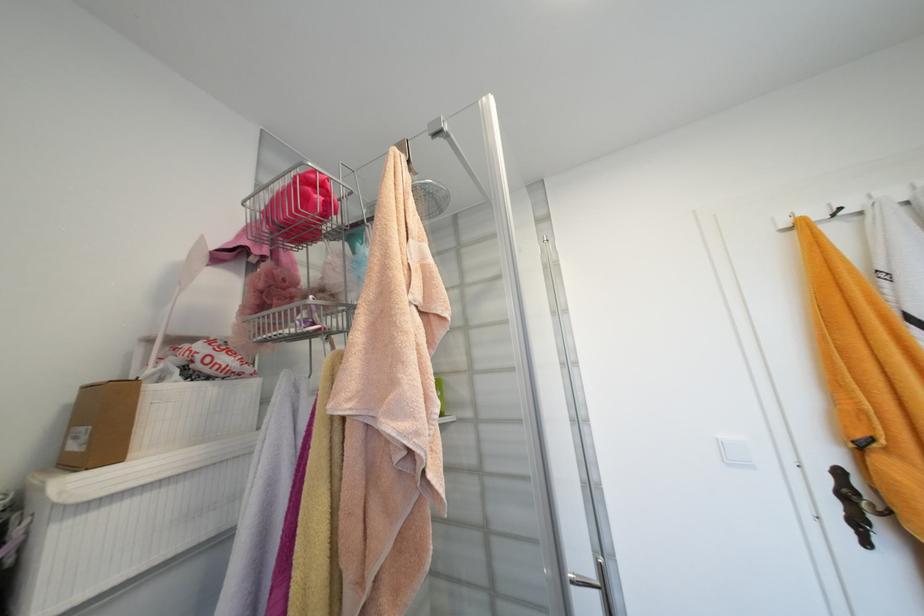
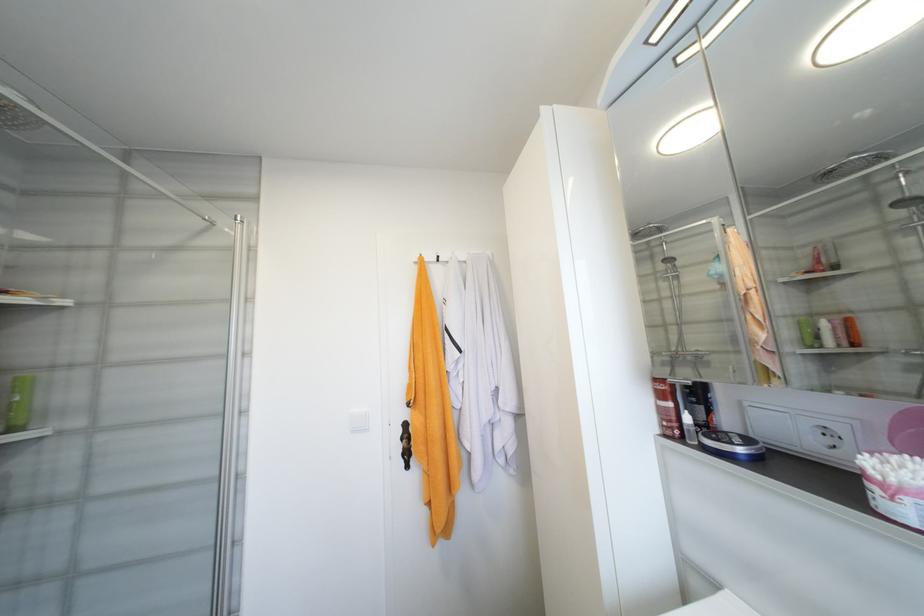
Question: The camera is either moving clockwise (left) or counter-clockwise (right) around the object. The first image is from the beginning of the video and the second image is from the end. Is the camera moving left or right when shooting the video?

Choices:
 (A) Left
 (B) Right

Answer: (A)